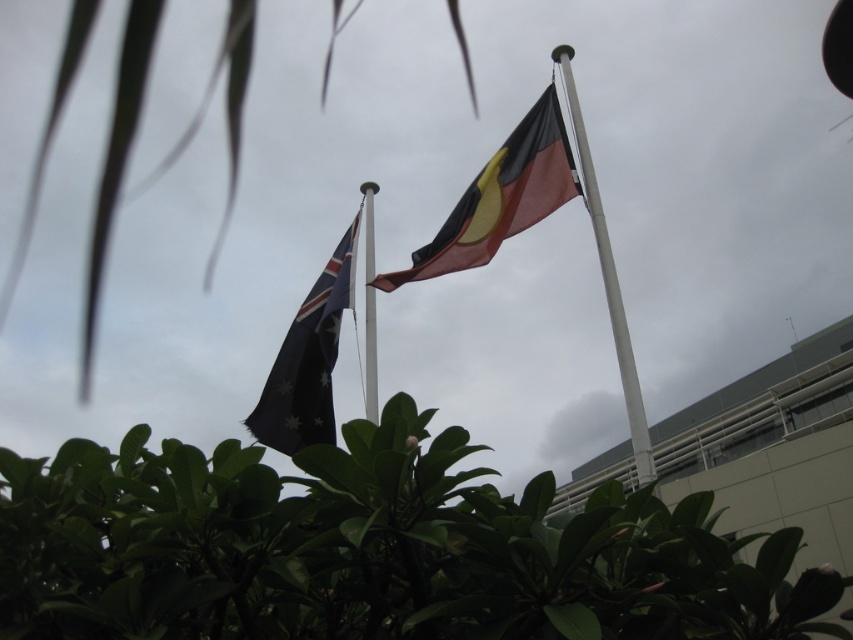
You are a photographer trying to capture both the green leafy plant at center and the silver metallic pole at center in a single shot. Since the plant is blocking part of the pole, can you adjust your position so that the pole becomes fully visible without moving the plant?

The green leafy plant at center is positioned on the left side of the silver metallic pole at center. By moving to the right side of the pole, you can position yourself so that the plant is no longer blocking the pole, allowing it to be fully visible in the shot.

You are a photographer trying to capture both the green leafy plant at center and the silver metallic pole at center in a single frame. Based on their widths, which object should you adjust your camera angle to focus on first to ensure both fit in the frame?

The green leafy plant at center might be wider than silver metallic pole at center, so you should focus on adjusting your camera angle to accommodate the wider green leafy plant at center first to ensure both fit in the frame.